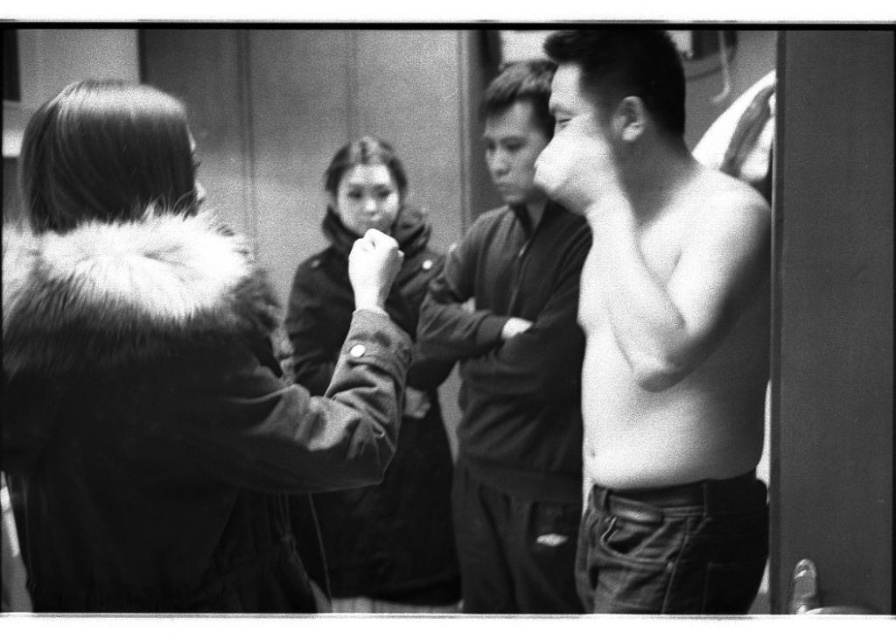
Does smooth black shirt at center have a smaller size compared to matte black jacket at center?

No, smooth black shirt at center is not smaller than matte black jacket at center.

Who is lower down, smooth black shirt at center or matte black jacket at center?

matte black jacket at center is below.

The width and height of the screenshot is (896, 640). Describe the element at coordinates (514, 365) in the screenshot. I see `smooth black shirt at center` at that location.

Locate an element on the screen. smooth black shirt at center is located at coordinates (x=514, y=365).

Between point (741, 545) and point (522, 317), which one is positioned in front?

Point (741, 545) is in front.

Who is lower down, smooth skin torso at center or smooth black shirt at center?

smooth black shirt at center

Is point (750, 355) closer to viewer compared to point (576, 419)?

Yes, point (750, 355) is closer to viewer.

I want to click on smooth skin torso at center, so click(660, 333).

Is smooth skin torso at center taller than matte black jacket at center?

In fact, smooth skin torso at center may be shorter than matte black jacket at center.

Where is `smooth skin torso at center`? The height and width of the screenshot is (640, 896). smooth skin torso at center is located at coordinates (660, 333).

Describe the element at coordinates (660, 333) in the screenshot. I see `smooth skin torso at center` at that location.

The image size is (896, 640). I want to click on smooth skin torso at center, so click(660, 333).